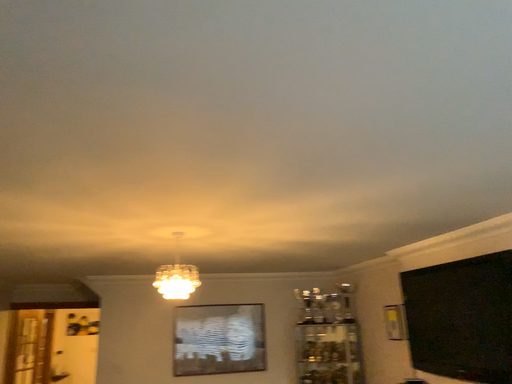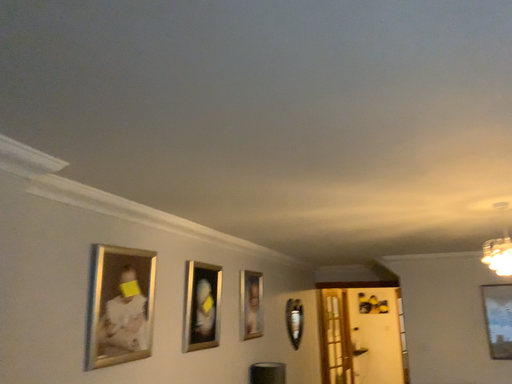
Question: How did the camera likely rotate when shooting the video?

Choices:
 (A) rotated left
 (B) rotated right

Answer: (A)